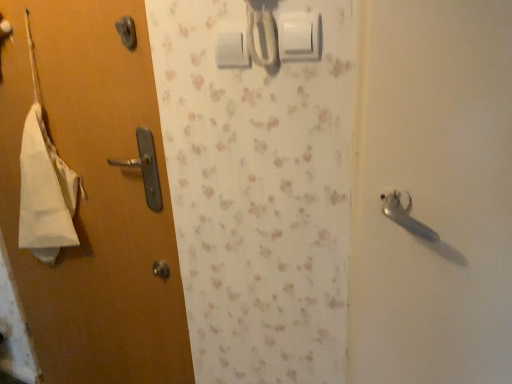
Question: Does matte wood door at left have a larger size compared to white plastic light switch at upper center, acting as the first light switch starting from the right?

Choices:
 (A) yes
 (B) no

Answer: (A)

Question: Is matte wood door at left far away from white plastic light switch at upper center, which is the 1th light switch in front-to-back order?

Choices:
 (A) no
 (B) yes

Answer: (A)

Question: From the image's perspective, is matte wood door at left located above white plastic light switch at upper center, acting as the first light switch starting from the right?

Choices:
 (A) yes
 (B) no

Answer: (B)

Question: Does matte wood door at left have a smaller size compared to white plastic light switch at upper center, the 2th light switch in the left-to-right sequence?

Choices:
 (A) yes
 (B) no

Answer: (B)

Question: From a real-world perspective, is matte wood door at left positioned over white plastic light switch at upper center, which is the second light switch in back-to-front order, based on gravity?

Choices:
 (A) yes
 (B) no

Answer: (B)

Question: From the image's perspective, is white plastic light switch at upper center, which is the first light switch in left-to-right order, located above or below white plastic light switch at upper center, which is the second light switch in back-to-front order?

Choices:
 (A) below
 (B) above

Answer: (B)

Question: From their relative heights in the image, would you say white plastic light switch at upper center, which is the 1th light switch in back-to-front order, is taller or shorter than white plastic light switch at upper center, which is the 1th light switch in front-to-back order?

Choices:
 (A) short
 (B) tall

Answer: (A)

Question: Considering the positions of white plastic light switch at upper center, which is the first light switch in left-to-right order, and white plastic light switch at upper center, which is the 1th light switch in front-to-back order, in the image, is white plastic light switch at upper center, which is the first light switch in left-to-right order, wider or thinner than white plastic light switch at upper center, which is the 1th light switch in front-to-back order,?

Choices:
 (A) thin
 (B) wide

Answer: (A)

Question: Do you think white plastic light switch at upper center, marked as the 2th light switch in a right-to-left arrangement, is within white plastic light switch at upper center, acting as the first light switch starting from the right, or outside of it?

Choices:
 (A) outside
 (B) inside

Answer: (A)

Question: Do you think white plastic light switch at upper center, which is the 1th light switch in back-to-front order, is within matte wood door at left, or outside of it?

Choices:
 (A) inside
 (B) outside

Answer: (B)

Question: Is white plastic light switch at upper center, which is the first light switch in left-to-right order, taller or shorter than matte wood door at left?

Choices:
 (A) tall
 (B) short

Answer: (B)

Question: Looking at their shapes, would you say white plastic light switch at upper center, arranged as the second light switch when viewed from the front, is wider or thinner than matte wood door at left?

Choices:
 (A) thin
 (B) wide

Answer: (A)

Question: Is point (234, 59) closer or farther from the camera than point (109, 129)?

Choices:
 (A) farther
 (B) closer

Answer: (B)

Question: Is matte wood door at left inside the boundaries of white plastic light switch at upper center, marked as the 2th light switch in a right-to-left arrangement, or outside?

Choices:
 (A) inside
 (B) outside

Answer: (B)

Question: Considering the positions of matte wood door at left and white plastic light switch at upper center, which is the 1th light switch in back-to-front order, in the image, is matte wood door at left wider or thinner than white plastic light switch at upper center, which is the 1th light switch in back-to-front order,?

Choices:
 (A) wide
 (B) thin

Answer: (A)